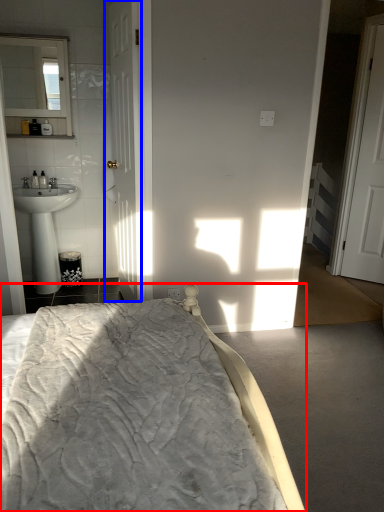
Question: Which point is closer to the camera, bed (highlighted by a red box) or door (highlighted by a blue box)?

Choices:
 (A) bed
 (B) door

Answer: (A)